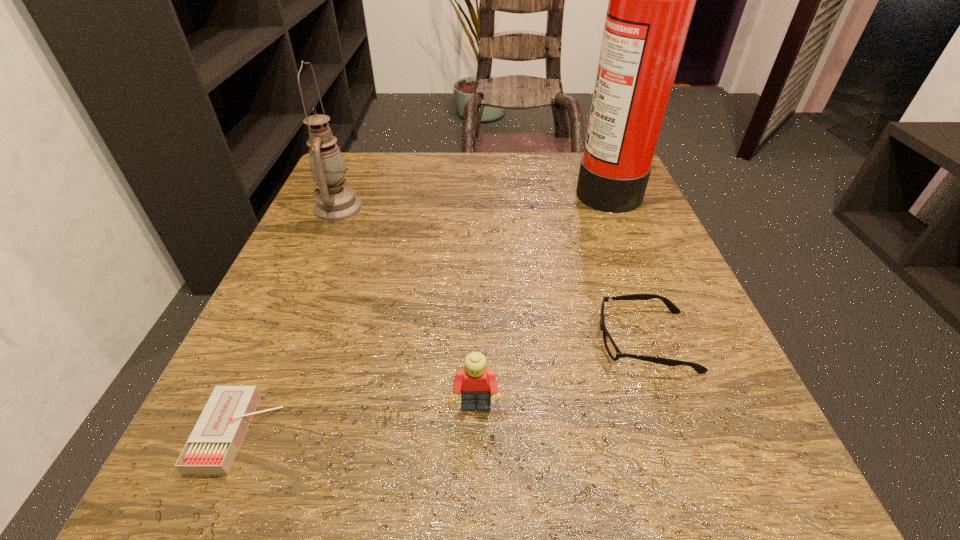
The image size is (960, 540). In order to click on fire extinguisher in this screenshot , I will do `click(651, 0)`.

Find the location of a particular element. This screenshot has width=960, height=540. oil lamp is located at coordinates (334, 202).

Locate an element on the screen. Lego is located at coordinates (477, 385).

Locate an element on the screen. the third shortest object is located at coordinates (477, 385).

Where is `the second shortest object`? the second shortest object is located at coordinates (614, 352).

This screenshot has height=540, width=960. In order to click on the third farthest object in this screenshot , I will do `click(614, 352)`.

Locate an element on the screen. The image size is (960, 540). matchbox is located at coordinates (211, 448).

You are a GUI agent. You are given a task and a screenshot of the screen. Output one action in this format:
    pyautogui.click(x=<x>, y=<y>)
    Task: Click on the vacant space located 0.050m on the front-facing side of the fire extinguisher
    
    Given the screenshot: What is the action you would take?
    pyautogui.click(x=552, y=186)

This screenshot has height=540, width=960. Find the location of `vacant point located 0.100m on the front-facing side of the fire extinguisher`. vacant point located 0.100m on the front-facing side of the fire extinguisher is located at coordinates (529, 186).

At what (x,y) coordinates should I click in order to perform the action: click on free region located 0.090m on the front-facing side of the fire extinguisher. Please return your answer as a coordinate pair (x, y). The height and width of the screenshot is (540, 960). Looking at the image, I should click on (534, 186).